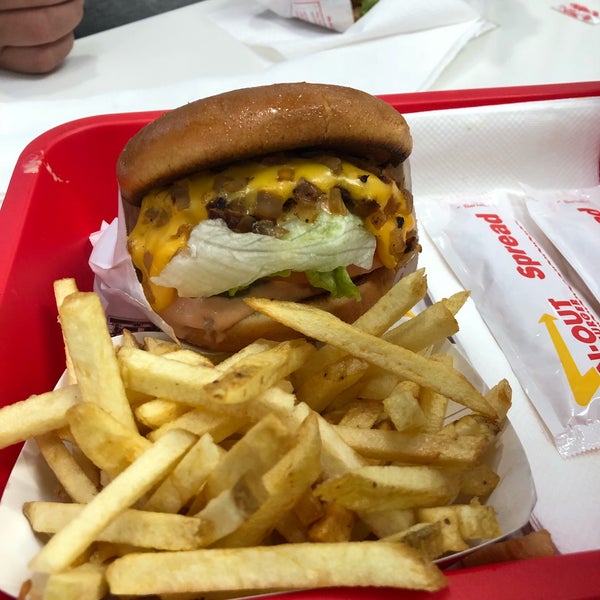
The height and width of the screenshot is (600, 600). I want to click on red plastic tray, so click(470, 587).